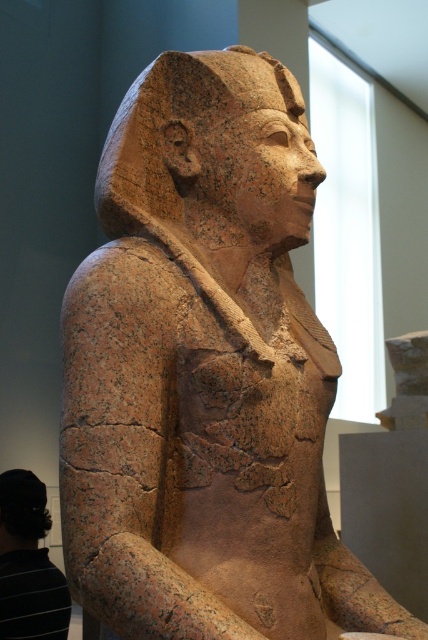
You are an archaeologist examining the ancient Egyptian statue. You notice a black striped shirt at lower left and a matte brown statue head at center. Which object is closer to you from your current viewpoint?

The black striped shirt at lower left is closer to you because it is in front of the matte brown statue head at center.

You are looking at an ancient Egyptian statue. There is a point at coordinates (x=29, y=563). What object is located at this point?

The point at coordinates (x=29, y=563) corresponds to the black striped shirt at lower left.